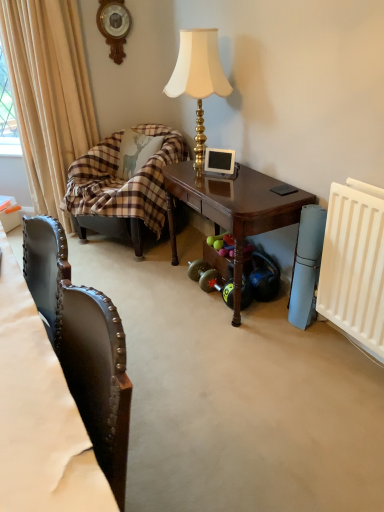
Question: Can you confirm if white plastic radiator at right is positioned to the right of beige fabric curtain at left?

Choices:
 (A) no
 (B) yes

Answer: (B)

Question: From the image's perspective, is white plastic radiator at right on top of beige fabric curtain at left?

Choices:
 (A) yes
 (B) no

Answer: (B)

Question: Is white plastic radiator at right to the left of beige fabric curtain at left from the viewer's perspective?

Choices:
 (A) yes
 (B) no

Answer: (B)

Question: Could you tell me if white plastic radiator at right is facing beige fabric curtain at left?

Choices:
 (A) yes
 (B) no

Answer: (B)

Question: Is white plastic radiator at right wider than beige fabric curtain at left?

Choices:
 (A) no
 (B) yes

Answer: (A)

Question: Does white plastic radiator at right have a larger size compared to beige fabric curtain at left?

Choices:
 (A) no
 (B) yes

Answer: (A)

Question: Does rubberized black dumbbell at lower right contain gold textured lamp at upper center?

Choices:
 (A) no
 (B) yes

Answer: (A)

Question: Is rubberized black dumbbell at lower right placed right next to gold textured lamp at upper center?

Choices:
 (A) yes
 (B) no

Answer: (B)

Question: From the image's perspective, is rubberized black dumbbell at lower right above gold textured lamp at upper center?

Choices:
 (A) no
 (B) yes

Answer: (A)

Question: Is rubberized black dumbbell at lower right to the right of gold textured lamp at upper center from the viewer's perspective?

Choices:
 (A) yes
 (B) no

Answer: (A)

Question: Does rubberized black dumbbell at lower right appear on the left side of gold textured lamp at upper center?

Choices:
 (A) no
 (B) yes

Answer: (A)

Question: Does rubberized black dumbbell at lower right have a smaller size compared to gold textured lamp at upper center?

Choices:
 (A) yes
 (B) no

Answer: (A)

Question: Is leather at left behind white plastic radiator at right?

Choices:
 (A) yes
 (B) no

Answer: (B)